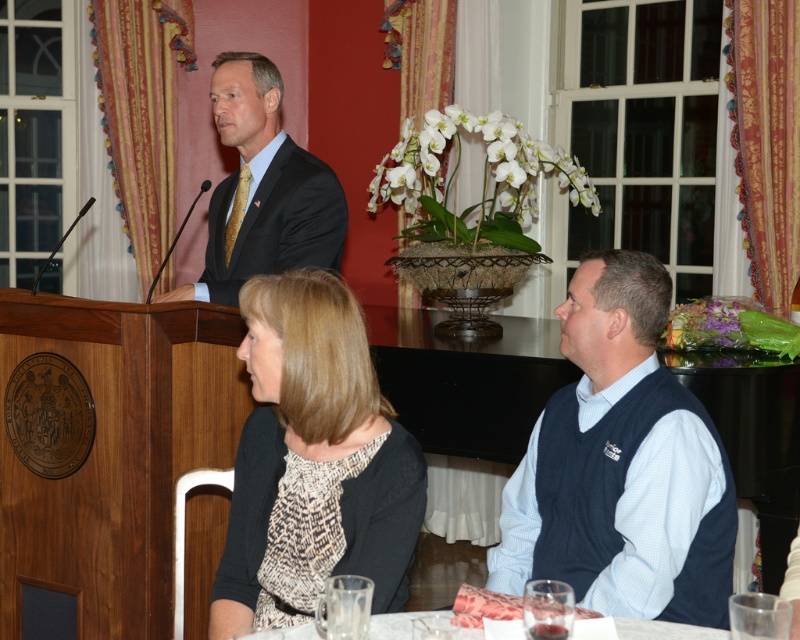
Question: Is navy blue sweater vest at right behind matte black suit at center?

Choices:
 (A) no
 (B) yes

Answer: (A)

Question: Does navy blue sweater vest at right appear on the right side of matte black suit at center?

Choices:
 (A) yes
 (B) no

Answer: (A)

Question: Does black knit sweater at lower left have a greater width compared to matte black suit at center?

Choices:
 (A) yes
 (B) no

Answer: (B)

Question: Which of these objects is positioned closest to the navy blue sweater vest at right?

Choices:
 (A) black knit sweater at lower left
 (B) matte black suit at center

Answer: (A)

Question: Which point is farther to the camera?

Choices:
 (A) (514, 540)
 (B) (260, 163)

Answer: (B)

Question: Which of the following is the farthest from the observer?

Choices:
 (A) (700, 480)
 (B) (340, 417)

Answer: (A)